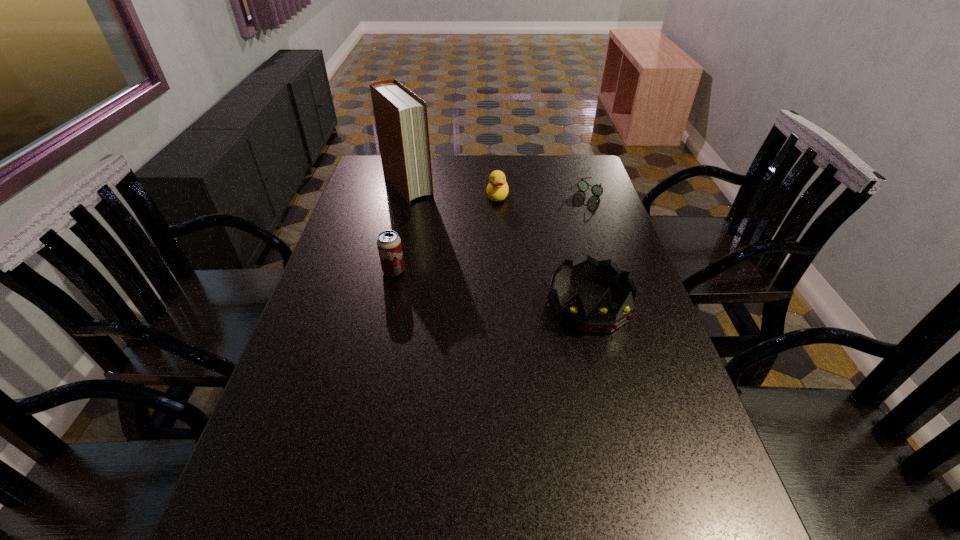
Find the location of `beer can`. beer can is located at coordinates (389, 245).

Locate an element on the screen. This screenshot has width=960, height=540. tiara is located at coordinates (601, 319).

Where is `the second shortest object`? This screenshot has width=960, height=540. the second shortest object is located at coordinates (497, 190).

Identify the location of the third object from right to left. The height and width of the screenshot is (540, 960). (497, 190).

The image size is (960, 540). Find the location of `the tallest object`. the tallest object is located at coordinates (401, 118).

The width and height of the screenshot is (960, 540). Identify the location of the shortest object. (597, 190).

In order to click on free space located on the back of the third tallest object in this screenshot , I will do `click(403, 226)`.

The height and width of the screenshot is (540, 960). What are the coordinates of `free space located 0.270m at the front of the fourth shortest object with jewels` in the screenshot? It's located at (624, 442).

Image resolution: width=960 pixels, height=540 pixels. Find the location of `free spot located on the face of the second shortest object`. free spot located on the face of the second shortest object is located at coordinates (494, 218).

Where is `free spot located 0.160m on the face of the second shortest object`? This screenshot has width=960, height=540. free spot located 0.160m on the face of the second shortest object is located at coordinates (492, 232).